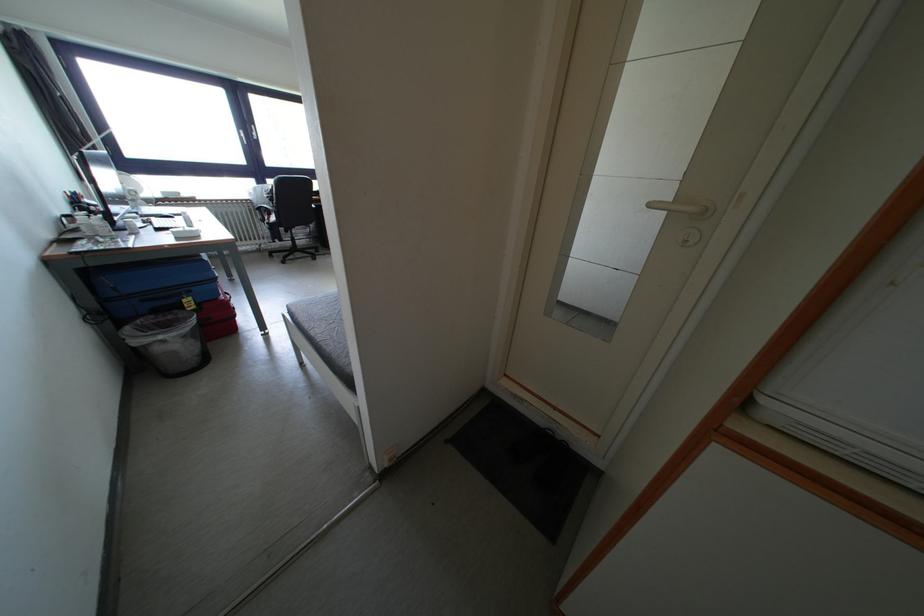
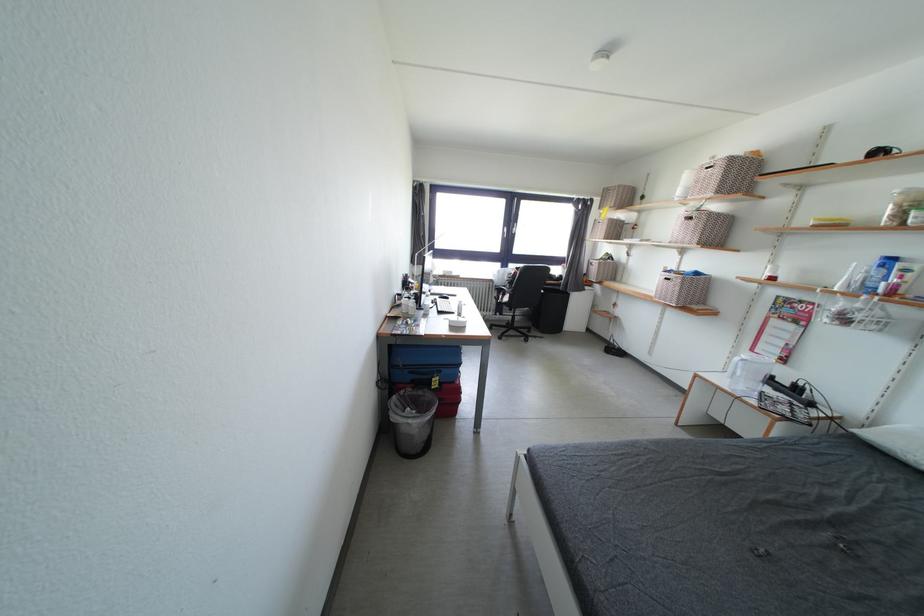
Find the pixel in the second image that matches (190,305) in the first image.

(440, 384)